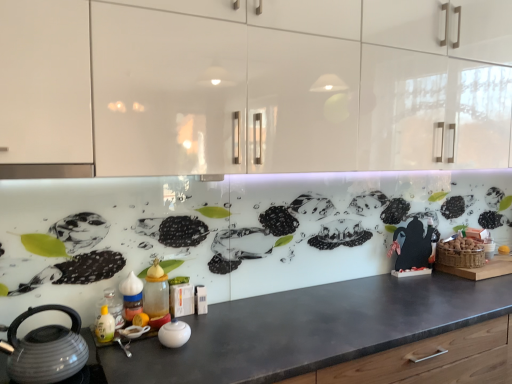
Question: From the image's perspective, is translucent plastic spice jar at center, the 2th bottle positioned from the left, on white glossy cabinets at upper center?

Choices:
 (A) yes
 (B) no

Answer: (B)

Question: From a real-world perspective, is translucent plastic spice jar at center, the 2th bottle positioned from the left, below white glossy cabinets at upper center?

Choices:
 (A) no
 (B) yes

Answer: (B)

Question: Is the position of translucent plastic spice jar at center, the 2th bottle positioned from the left, more distant than that of white glossy cabinets at upper center?

Choices:
 (A) yes
 (B) no

Answer: (A)

Question: Is translucent plastic spice jar at center, the 2th bottle when ordered from right to left, looking in the opposite direction of white glossy cabinets at upper center?

Choices:
 (A) no
 (B) yes

Answer: (A)

Question: From a real-world perspective, does translucent plastic spice jar at center, the 2th bottle positioned from the left, stand above white glossy cabinets at upper center?

Choices:
 (A) yes
 (B) no

Answer: (B)

Question: From the image's perspective, is white glossy cabinets at upper center located above or below translucent plastic bottle at lower left, the third bottle in the right-to-left sequence?

Choices:
 (A) above
 (B) below

Answer: (A)

Question: From a real-world perspective, is white glossy cabinets at upper center positioned above or below translucent plastic bottle at lower left, which is counted as the first bottle, starting from the left?

Choices:
 (A) below
 (B) above

Answer: (B)

Question: Considering their positions, is white glossy cabinets at upper center located in front of or behind translucent plastic bottle at lower left, which is counted as the first bottle, starting from the left?

Choices:
 (A) front
 (B) behind

Answer: (A)

Question: Considering the positions of white glossy cabinets at upper center and translucent plastic bottle at lower left, which is counted as the first bottle, starting from the left, in the image, is white glossy cabinets at upper center wider or thinner than translucent plastic bottle at lower left, which is counted as the first bottle, starting from the left,?

Choices:
 (A) wide
 (B) thin

Answer: (A)

Question: In terms of width, does white glossy cabinets at upper center look wider or thinner when compared to matte black countertop at center?

Choices:
 (A) wide
 (B) thin

Answer: (B)

Question: Would you say white glossy cabinets at upper center is inside or outside matte black countertop at center?

Choices:
 (A) inside
 (B) outside

Answer: (B)

Question: In the image, is white glossy cabinets at upper center positioned in front of or behind matte black countertop at center?

Choices:
 (A) behind
 (B) front

Answer: (A)

Question: Does point (441, 119) appear closer or farther from the camera than point (330, 299)?

Choices:
 (A) closer
 (B) farther

Answer: (B)

Question: Is translucent plastic spice jar at center, the 2th bottle when ordered from right to left, wider or thinner than translucent plastic bottle at lower left, which is counted as the first bottle, starting from the left?

Choices:
 (A) thin
 (B) wide

Answer: (A)

Question: Is translucent plastic spice jar at center, the 2th bottle positioned from the left, situated inside translucent plastic bottle at lower left, which is counted as the first bottle, starting from the left, or outside?

Choices:
 (A) outside
 (B) inside

Answer: (A)